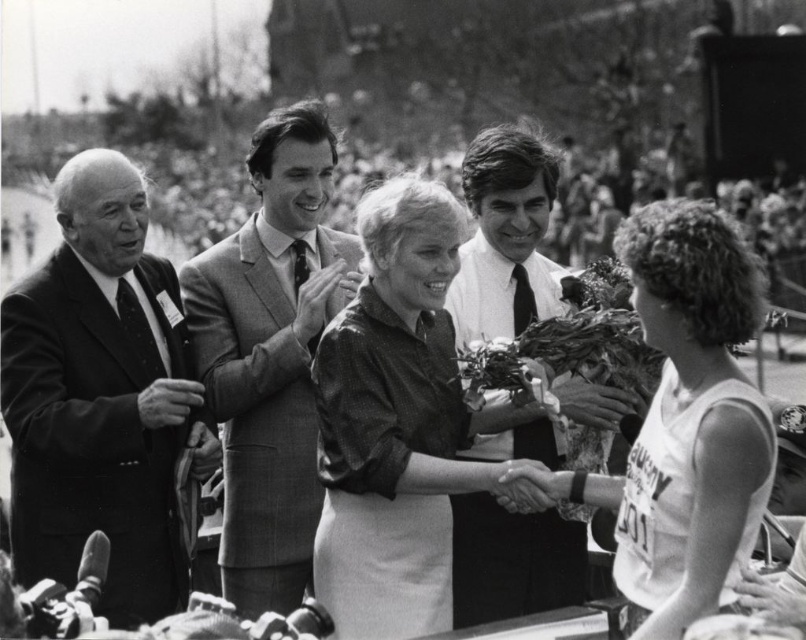
You are a photographer at this event. You need to capture a photo where both the white jersey at center and the smooth suit at center are clearly visible. Which object should you focus on first to ensure both are in frame?

The white jersey at center has a smaller size compared to smooth suit at center, so you should focus on the white jersey at center first to ensure both are in frame.

Based on the scene described, which object is shorter in height between the smooth suit at left and the white shirt at center?

The smooth suit at left is shorter than the white shirt at center according to the description.

You are a photographer at this event and want to capture a photo that includes both the white jersey at center and the smooth suit at center. Your camera has a maximum focus range of 18 meters. Can you fit both subjects into the frame without moving closer?

The distance between the white jersey at center and the smooth suit at center is 19.22 meters, which exceeds the camera maximum focus range of 18 meters. Therefore, you cannot fit both subjects into the frame without moving closer.